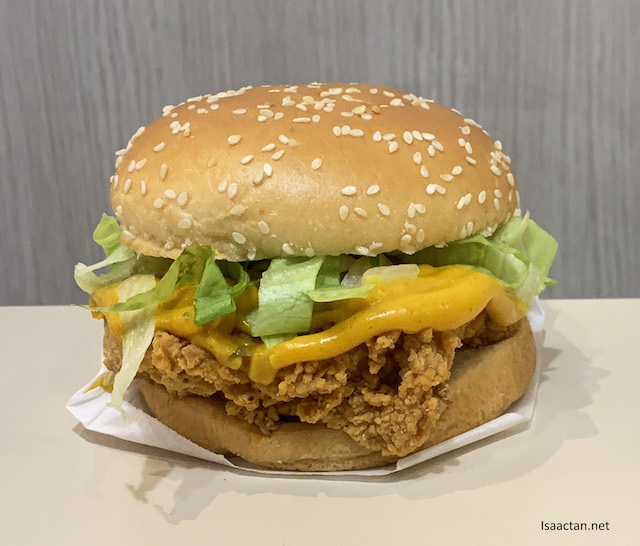
Find the location of a particular element. surface is located at coordinates (44, 426).